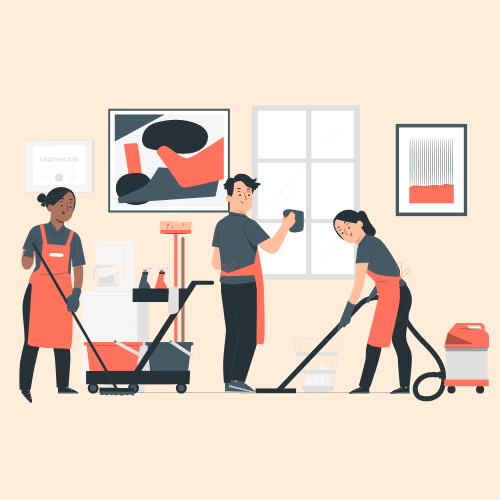
The image size is (500, 500). In order to click on cleaning spray bottles in this screenshot , I will do `click(161, 281)`, `click(145, 284)`.